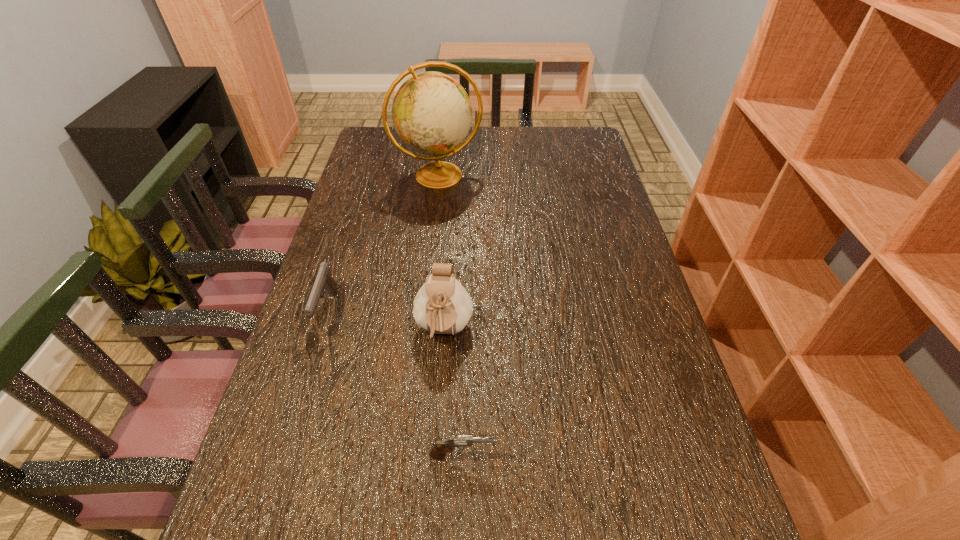
Image resolution: width=960 pixels, height=540 pixels. Find the location of `empty location between the leftmost object and the globe`. empty location between the leftmost object and the globe is located at coordinates (383, 243).

This screenshot has height=540, width=960. Identify the location of vacant area that lies between the nearer pistol and the leftmost object. (395, 383).

Where is `free space between the left pistol and the shortest object`? This screenshot has height=540, width=960. free space between the left pistol and the shortest object is located at coordinates 395,383.

Where is `free space between the farther pistol and the second tallest object`? free space between the farther pistol and the second tallest object is located at coordinates coord(386,321).

Locate an element on the screen. The image size is (960, 540). free space between the shorter pistol and the farther pistol is located at coordinates (395, 383).

Locate an element on the screen. This screenshot has width=960, height=540. free space that is in between the shorter pistol and the second tallest object is located at coordinates (453, 393).

Locate an element on the screen. Image resolution: width=960 pixels, height=540 pixels. vacant area between the farthest object and the second tallest object is located at coordinates (442, 253).

The width and height of the screenshot is (960, 540). Identify the location of vacant region between the right pistol and the taller pistol. (395, 383).

Point out which object is positioned as the third nearest to the farther pistol. Please provide its 2D coordinates. Your answer should be formatted as a tuple, i.e. [(x, y)], where the tuple contains the x and y coordinates of a point satisfying the conditions above.

[(432, 114)]

Select which object is the second closest to the second tallest object. Please provide its 2D coordinates. Your answer should be formatted as a tuple, i.e. [(x, y)], where the tuple contains the x and y coordinates of a point satisfying the conditions above.

[(324, 282)]